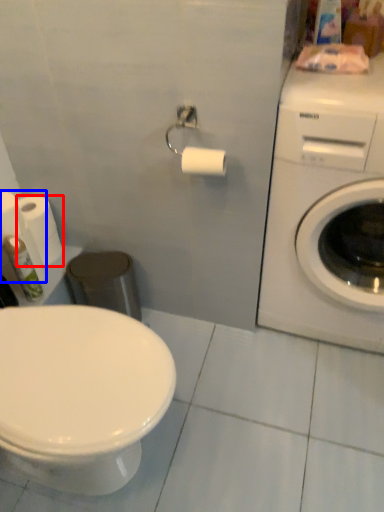
Question: Which object is further to the camera taking this photo, toilet paper (highlighted by a red box) or toilet paper (highlighted by a blue box)?

Choices:
 (A) toilet paper
 (B) toilet paper

Answer: (A)